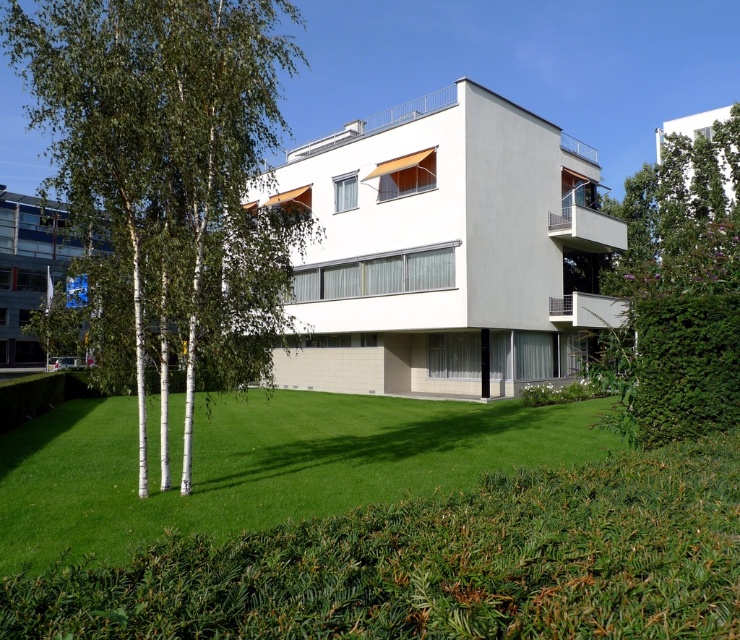
Question: Does green leafy tree at left lie behind green leafy tree at upper right?

Choices:
 (A) no
 (B) yes

Answer: (B)

Question: Which of the following is the farthest from the observer?

Choices:
 (A) (696, 394)
 (B) (117, 312)

Answer: (B)

Question: Observing the image, what is the correct spatial positioning of green leafy tree at left in reference to green leafy tree at upper right?

Choices:
 (A) left
 (B) right

Answer: (A)

Question: Which object is farther from the camera taking this photo?

Choices:
 (A) green leafy tree at upper right
 (B) green leafy tree at left

Answer: (B)

Question: Is green leafy tree at left wider than green leafy tree at upper right?

Choices:
 (A) yes
 (B) no

Answer: (A)